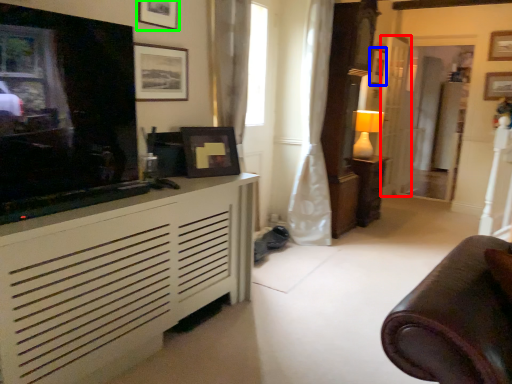
Question: Considering the real-world distances, which object is farthest from door (highlighted by a red box)? picture frame (highlighted by a blue box) or picture frame (highlighted by a green box)?

Choices:
 (A) picture frame
 (B) picture frame

Answer: (B)